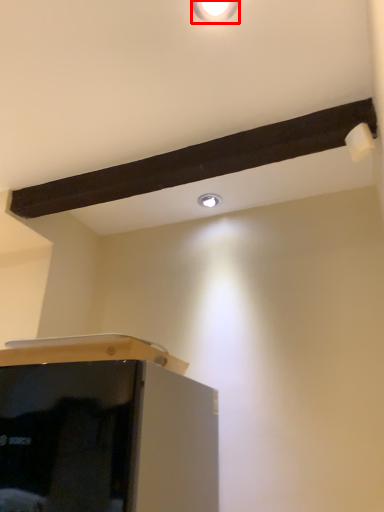
Question: From the image's perspective, where is light fixture (annotated by the red box) located in relation to droplight in the image?

Choices:
 (A) above
 (B) below

Answer: (A)